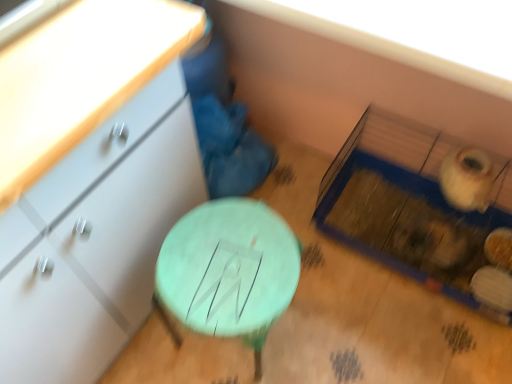
Locate an element on the screen. Image resolution: width=512 pixels, height=384 pixels. green painted wood stool at center is located at coordinates (229, 270).

Measure the distance between green painted wood stool at center and camera.

green painted wood stool at center and camera are 34.23 inches apart from each other.

What do you see at coordinates (229, 270) in the screenshot? I see `green painted wood stool at center` at bounding box center [229, 270].

What is the approximate height of green painted wood stool at center?

It is 17.77 inches.

Describe the element at coordinates (90, 181) in the screenshot. This screenshot has width=512, height=384. I see `matte white chest of drawers at left` at that location.

Measure the distance between point (99, 164) and camera.

The depth of point (99, 164) is 30.67 inches.

Identify the location of matte white chest of drawers at left. (90, 181).

Find the location of `green painted wood stool at center`. green painted wood stool at center is located at coordinates (229, 270).

Considering the positions of objects green painted wood stool at center and matte white chest of drawers at left in the image provided, who is more to the right, green painted wood stool at center or matte white chest of drawers at left?

From the viewer's perspective, green painted wood stool at center appears more on the right side.

Is the depth of green painted wood stool at center less than that of matte white chest of drawers at left?

No, green painted wood stool at center is behind matte white chest of drawers at left.

Is point (183, 309) closer or farther from the camera than point (3, 59)?

Clearly, point (183, 309) is more distant from the camera than point (3, 59).

From the image's perspective, which one is positioned higher, green painted wood stool at center or matte white chest of drawers at left?

matte white chest of drawers at left, from the image's perspective.

From a real-world perspective, is green painted wood stool at center on matte white chest of drawers at left?

No, from a real-world perspective, green painted wood stool at center is not above matte white chest of drawers at left.

Considering the relative sizes of green painted wood stool at center and matte white chest of drawers at left in the image provided, is green painted wood stool at center wider than matte white chest of drawers at left?

No.

Considering the sizes of green painted wood stool at center and matte white chest of drawers at left in the image, is green painted wood stool at center taller or shorter than matte white chest of drawers at left?

Clearly, green painted wood stool at center is shorter compared to matte white chest of drawers at left.

Is green painted wood stool at center bigger or smaller than matte white chest of drawers at left?

In the image, green painted wood stool at center appears to be smaller than matte white chest of drawers at left.

Based on the photo, can we say green painted wood stool at center lies outside matte white chest of drawers at left?

Yes, green painted wood stool at center is located beyond the bounds of matte white chest of drawers at left.

Is green painted wood stool at center next to matte white chest of drawers at left?

No.

Is matte white chest of drawers at left at the back of green painted wood stool at center?

Yes, green painted wood stool at center is facing away from matte white chest of drawers at left.

What's the angular difference between green painted wood stool at center and matte white chest of drawers at left's facing directions?

The angular difference between green painted wood stool at center and matte white chest of drawers at left is 0.00016 degrees.

The image size is (512, 384). I want to click on the chest of drawers located in front of the green painted wood stool at center, so click(x=90, y=181).

Looking at this image, considering the relative positions of matte white chest of drawers at left and green painted wood stool at center in the image provided, is matte white chest of drawers at left to the right of green painted wood stool at center from the viewer's perspective?

No.

Is matte white chest of drawers at left positioned behind green painted wood stool at center?

No, it is not.

Which is closer to the camera, [118,184] or [242,228]?

Point [118,184].

From the image's perspective, who appears lower, matte white chest of drawers at left or green painted wood stool at center?

From the image's view, green painted wood stool at center is below.

From a real-world perspective, is matte white chest of drawers at left on top of green painted wood stool at center?

Indeed, from a real-world perspective, matte white chest of drawers at left stands above green painted wood stool at center.

Does matte white chest of drawers at left have a greater width compared to green painted wood stool at center?

Correct, the width of matte white chest of drawers at left exceeds that of green painted wood stool at center.

Considering the sizes of objects matte white chest of drawers at left and green painted wood stool at center in the image provided, who is shorter, matte white chest of drawers at left or green painted wood stool at center?

With less height is green painted wood stool at center.

Which of these two, matte white chest of drawers at left or green painted wood stool at center, is bigger?

matte white chest of drawers at left is bigger.

Is green painted wood stool at center a part of matte white chest of drawers at left?

No, green painted wood stool at center is not surrounded by matte white chest of drawers at left.

Would you say matte white chest of drawers at left is a long distance from green painted wood stool at center?

matte white chest of drawers at left is near green painted wood stool at center, not far away.

Could you tell me if matte white chest of drawers at left is turned towards green painted wood stool at center?

Yes, matte white chest of drawers at left is aimed at green painted wood stool at center.

How many degrees apart are the facing directions of matte white chest of drawers at left and green painted wood stool at center?

The facing directions of matte white chest of drawers at left and green painted wood stool at center are 0.00016 degrees apart.

At what (x,y) coordinates should I click in order to perform the action: click on chest of drawers on the left of green painted wood stool at center. Please return your answer as a coordinate pair (x, y). Looking at the image, I should click on (90, 181).

Where is `table to the right of matte white chest of drawers at left`? The width and height of the screenshot is (512, 384). table to the right of matte white chest of drawers at left is located at coordinates (229, 270).

Identify the location of table that is below the matte white chest of drawers at left (from the image's perspective). (229, 270).